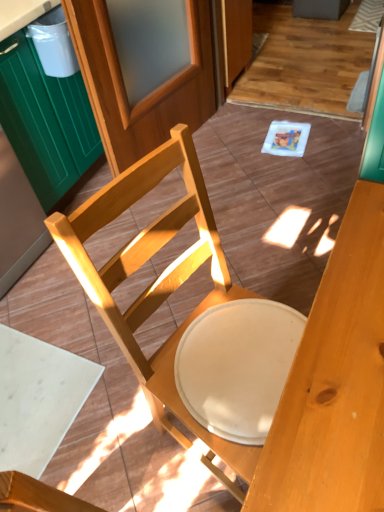
Question: Are wooden screen door at upper center and wooden chair at center far apart?

Choices:
 (A) no
 (B) yes

Answer: (B)

Question: Considering the relative sizes of wooden screen door at upper center and wooden chair at center in the image provided, is wooden screen door at upper center smaller than wooden chair at center?

Choices:
 (A) no
 (B) yes

Answer: (B)

Question: From the image's perspective, is wooden screen door at upper center located above wooden chair at center?

Choices:
 (A) no
 (B) yes

Answer: (B)

Question: Is wooden screen door at upper center looking in the opposite direction of wooden chair at center?

Choices:
 (A) no
 (B) yes

Answer: (A)

Question: Is wooden chair at center inside wooden screen door at upper center?

Choices:
 (A) yes
 (B) no

Answer: (B)

Question: Can we say wooden screen door at upper center lies outside wooden chair at center?

Choices:
 (A) yes
 (B) no

Answer: (A)

Question: From a real-world perspective, is wooden chair at center physically below white plastic trash bin at upper left?

Choices:
 (A) no
 (B) yes

Answer: (B)

Question: Considering the relative positions of wooden chair at center and white plastic trash bin at upper left in the image provided, is wooden chair at center behind white plastic trash bin at upper left?

Choices:
 (A) yes
 (B) no

Answer: (B)

Question: Can you confirm if wooden chair at center is shorter than white plastic trash bin at upper left?

Choices:
 (A) yes
 (B) no

Answer: (B)

Question: Is white plastic trash bin at upper left at the back of wooden chair at center?

Choices:
 (A) no
 (B) yes

Answer: (A)

Question: Is wooden chair at center outside of white plastic trash bin at upper left?

Choices:
 (A) yes
 (B) no

Answer: (A)

Question: Can you confirm if wooden chair at center is smaller than white plastic trash bin at upper left?

Choices:
 (A) yes
 (B) no

Answer: (B)

Question: Is green wood cabinet at left completely or partially inside wooden screen door at upper center?

Choices:
 (A) no
 (B) yes

Answer: (A)